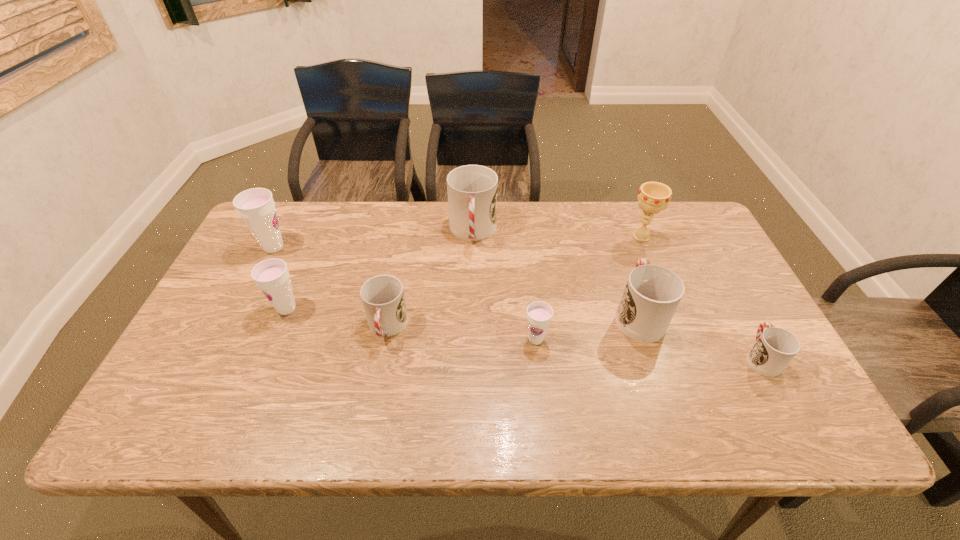
Identify the location of object that is positioned at the far left corner. This screenshot has width=960, height=540. (256, 206).

In the image, there is a desktop. Where is `vacant space at the far edge`? The width and height of the screenshot is (960, 540). vacant space at the far edge is located at coordinates (540, 223).

The image size is (960, 540). In the image, there is a desktop. In order to click on vacant region at the near edge in this screenshot , I will do `click(413, 404)`.

Identify the location of vacant point at the left edge. (252, 280).

This screenshot has height=540, width=960. What are the coordinates of `vacant space at the right edge of the desktop` in the screenshot? It's located at (787, 395).

In the image, there is a desktop. Where is `vacant space at the far left corner`? The image size is (960, 540). vacant space at the far left corner is located at coordinates (295, 204).

Image resolution: width=960 pixels, height=540 pixels. What are the coordinates of `vacant area at the near left corner` in the screenshot? It's located at (191, 430).

Identify the location of blank space at the near right corner. This screenshot has height=540, width=960. (793, 420).

At what (x,y) coordinates should I click in order to perform the action: click on vacant space that is in between the chalice and the shortest cup. Please return your answer as a coordinate pair (x, y). The width and height of the screenshot is (960, 540). Looking at the image, I should click on [701, 297].

Locate an element on the screen. The width and height of the screenshot is (960, 540). vacant space that's between the smallest purple cup and the second purple cup from left to right is located at coordinates (411, 324).